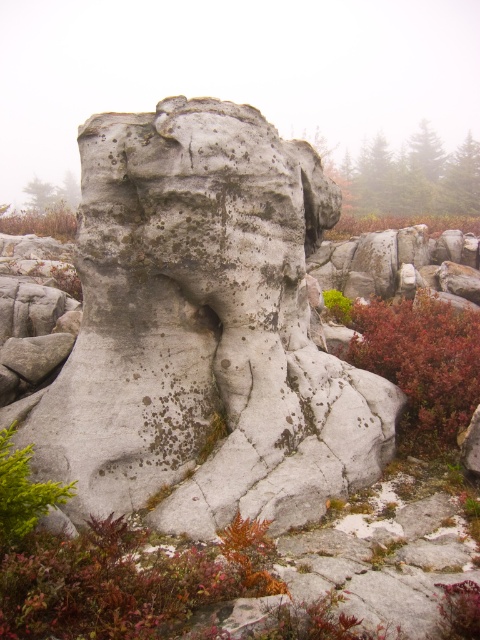
Question: Which of the following is the farthest from the observer?

Choices:
 (A) gray rough rock at center
 (B) leathery red shrub at center right
 (C) green leafy plant at center

Answer: (C)

Question: Which object is the farthest from the green leafy plant at center?

Choices:
 (A) smooth red plant at lower right
 (B) leathery red shrub at center right

Answer: (A)

Question: Considering the relative positions of gray rough rock at center and green leafy plant at center in the image provided, where is gray rough rock at center located with respect to green leafy plant at center?

Choices:
 (A) left
 (B) right

Answer: (A)

Question: Is green leafy plant at lower left wider than green leafy plant at left?

Choices:
 (A) no
 (B) yes

Answer: (A)

Question: Which object is positioned farthest from the green leafy plant at lower left?

Choices:
 (A) leathery brown shrub at center
 (B) green leafy plant at center
 (C) smooth red plant at lower right
 (D) green leafy plant at left

Answer: (D)

Question: Where is leathery red shrub at center right located in relation to green leafy plant at left in the image?

Choices:
 (A) above
 (B) below

Answer: (B)